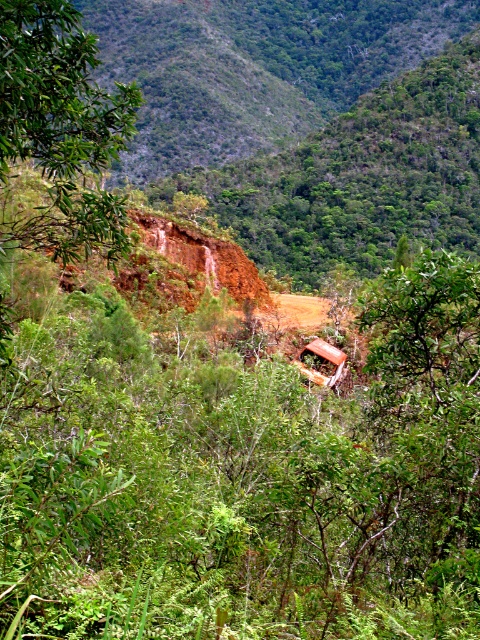
Does green leafy tree at left lie in front of rusty metal jeep at center?

That is True.

Identify the location of green leafy tree at left. (60, 129).